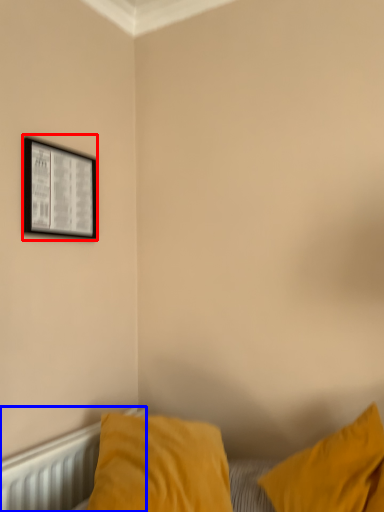
Question: Which object appears closest to the camera in this image, picture frame (highlighted by a red box) or radiator (highlighted by a blue box)?

Choices:
 (A) picture frame
 (B) radiator

Answer: (B)